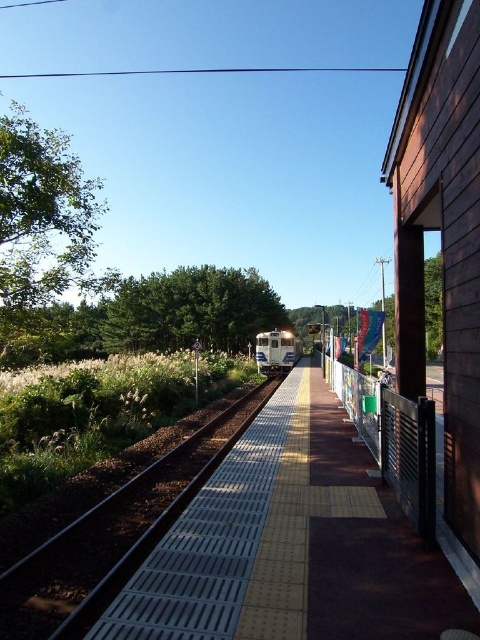
Question: From the image, what is the correct spatial relationship of yellow textured platform at center in relation to metallic silver train track at center?

Choices:
 (A) left
 (B) right

Answer: (B)

Question: Does yellow textured platform at center appear on the right side of metallic silver train track at center?

Choices:
 (A) yes
 (B) no

Answer: (A)

Question: Which object is the farthest from the yellow textured platform at center?

Choices:
 (A) metallic silver train track at center
 (B) blue glossy train at center

Answer: (B)

Question: Considering the relative positions of yellow textured platform at center and blue glossy train at center in the image provided, where is yellow textured platform at center located with respect to blue glossy train at center?

Choices:
 (A) below
 (B) above

Answer: (B)

Question: Which object appears closest to the camera in this image?

Choices:
 (A) yellow textured platform at center
 (B) metallic silver train track at center
 (C) blue glossy train at center

Answer: (A)

Question: Which of the following is the farthest from the observer?

Choices:
 (A) (153, 480)
 (B) (273, 365)

Answer: (B)